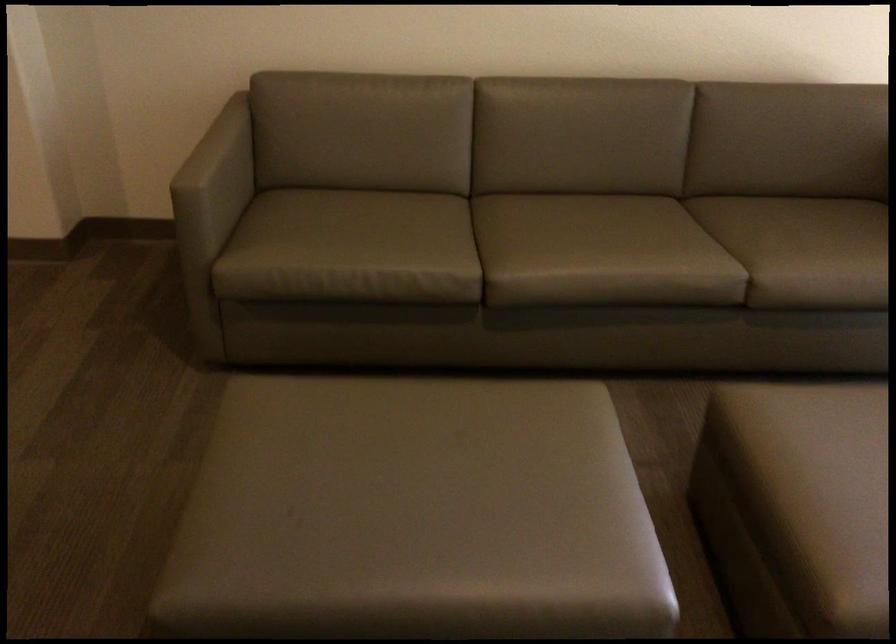
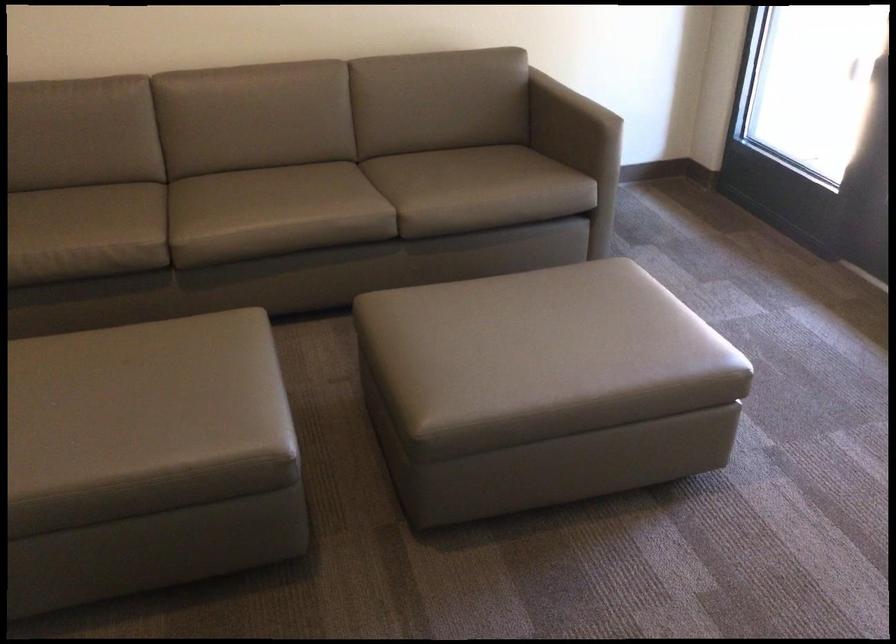
Which direction would the cameraman need to move to produce the second image?

The cameraman moved toward right, backward.